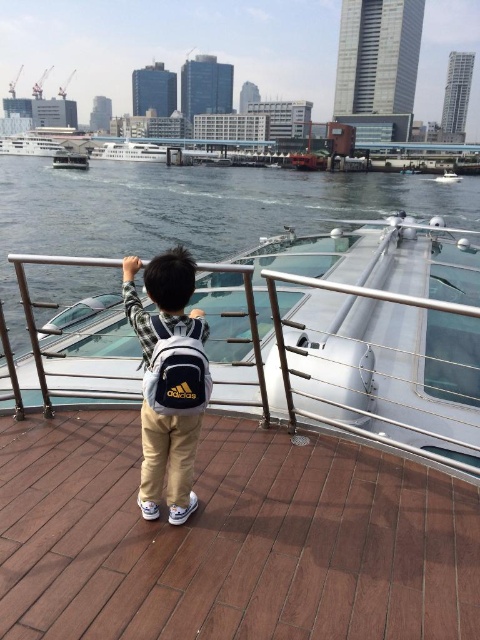
Between khaki cotton pants at center and metallic gray boat at upper center, which one appears on the right side from the viewer's perspective?

khaki cotton pants at center is more to the right.

Image resolution: width=480 pixels, height=640 pixels. Describe the element at coordinates (168, 380) in the screenshot. I see `khaki cotton pants at center` at that location.

The width and height of the screenshot is (480, 640). What are the coordinates of `khaki cotton pants at center` in the screenshot? It's located at (168, 380).

Can you confirm if clear water at center is positioned to the right of khaki cotton pants at center?

No, clear water at center is not to the right of khaki cotton pants at center.

Looking at this image, is clear water at center closer to the viewer compared to khaki cotton pants at center?

No, clear water at center is behind khaki cotton pants at center.

Where is `clear water at center`? clear water at center is located at coordinates click(192, 211).

Can you confirm if clear water at center is smaller than metallic gray boat at upper center?

Actually, clear water at center might be larger than metallic gray boat at upper center.

Is clear water at center thinner than metallic gray boat at upper center?

No.

Is point (106, 230) positioned before point (54, 154)?

Yes, it is in front of point (54, 154).

Where is `clear water at center`? This screenshot has width=480, height=640. clear water at center is located at coordinates (192, 211).